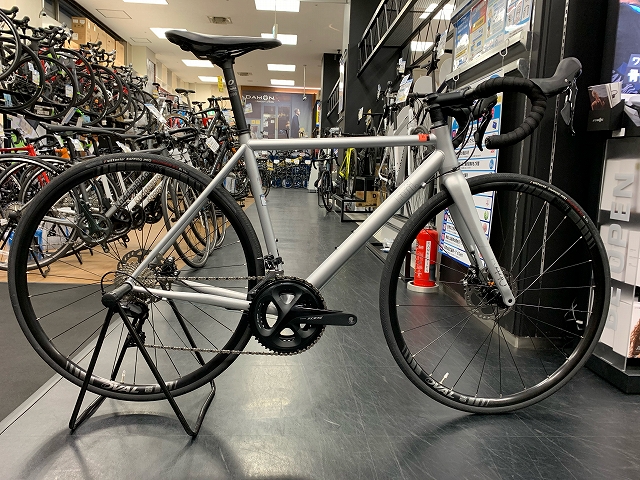
At what (x,y) coordinates should I click in order to perform the action: click on ceiling lights. Please return your answer as a coordinate pair (x, y). Looking at the image, I should click on tap(289, 83), tap(282, 5), tap(284, 40), tap(288, 66), tap(208, 82), tap(195, 63), tap(166, 31), tap(150, 1).